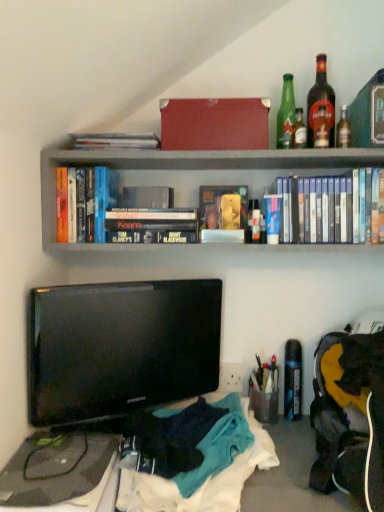
Question: Is matte red box at upper center completely or partially outside of blue matte book at center, which appears as the third paperback book when viewed from the left?

Choices:
 (A) yes
 (B) no

Answer: (A)

Question: Considering the relative sizes of matte red box at upper center and blue matte book at center, which appears as the third paperback book when viewed from the left, in the image provided, is matte red box at upper center wider than blue matte book at center, which appears as the third paperback book when viewed from the left,?

Choices:
 (A) yes
 (B) no

Answer: (A)

Question: Is blue matte book at center, which appears as the third paperback book when viewed from the left, surrounded by matte red box at upper center?

Choices:
 (A) no
 (B) yes

Answer: (A)

Question: Would you say matte red box at upper center is a long distance from blue matte book at center, which appears as the third paperback book when viewed from the left?

Choices:
 (A) yes
 (B) no

Answer: (B)

Question: Is matte red box at upper center taller than blue matte book at center, the 2th paperback book in the right-to-left sequence?

Choices:
 (A) yes
 (B) no

Answer: (A)

Question: Considering their positions, is green glass bottle at upper right, placed as the 1th bottle when sorted from right to left, located in front of or behind blue matte book at center, the 2th paperback book in the right-to-left sequence?

Choices:
 (A) behind
 (B) front

Answer: (A)

Question: Considering the positions of point (342, 145) and point (268, 212), is point (342, 145) closer or farther from the camera than point (268, 212)?

Choices:
 (A) closer
 (B) farther

Answer: (B)

Question: In terms of width, does green glass bottle at upper right, placed as the 1th bottle when sorted from right to left, look wider or thinner when compared to blue matte book at center, which appears as the third paperback book when viewed from the left?

Choices:
 (A) thin
 (B) wide

Answer: (A)

Question: From the image's perspective, is green glass bottle at upper right, which appears as the 4th bottle when viewed from the left, above or below blue matte book at center, which appears as the third paperback book when viewed from the left?

Choices:
 (A) above
 (B) below

Answer: (A)

Question: From a real-world perspective, is black glossy tv at lower left above or below matte red box at upper center?

Choices:
 (A) below
 (B) above

Answer: (A)

Question: Is black glossy tv at lower left inside or outside of matte red box at upper center?

Choices:
 (A) outside
 (B) inside

Answer: (A)

Question: Would you say black glossy tv at lower left is to the left or to the right of matte red box at upper center in the picture?

Choices:
 (A) left
 (B) right

Answer: (A)

Question: In terms of size, does black glossy tv at lower left appear bigger or smaller than matte red box at upper center?

Choices:
 (A) big
 (B) small

Answer: (A)

Question: Does point coord(135,391) appear closer or farther from the camera than point coord(332,153)?

Choices:
 (A) closer
 (B) farther

Answer: (B)

Question: Based on their sizes in the image, would you say black glossy tv at lower left is bigger or smaller than hardcover books at upper center?

Choices:
 (A) big
 (B) small

Answer: (B)